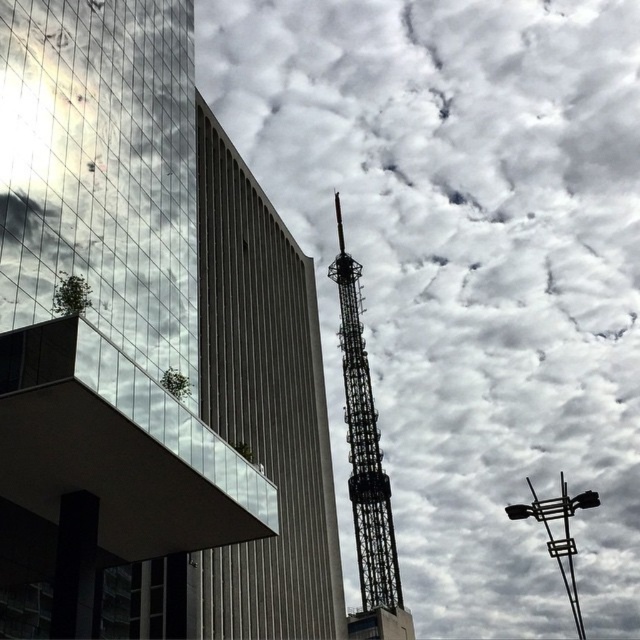
Question: Estimate the real-world distances between objects in this image. Which object is closer to the metallic lattice tower at center?

Choices:
 (A) metallic lattice tower at upper center
 (B) cloudy sky at upper center

Answer: (B)

Question: Among these objects, which one is farthest from the camera?

Choices:
 (A) cloudy sky at upper center
 (B) metallic lattice tower at upper center
 (C) metallic lattice tower at center

Answer: (A)

Question: Can you confirm if cloudy sky at upper center is smaller than metallic lattice tower at center?

Choices:
 (A) yes
 (B) no

Answer: (B)

Question: Can you confirm if metallic lattice tower at upper center is positioned above metallic lattice tower at center?

Choices:
 (A) yes
 (B) no

Answer: (A)

Question: Is the position of cloudy sky at upper center less distant than that of metallic lattice tower at center?

Choices:
 (A) yes
 (B) no

Answer: (B)

Question: Among these points, which one is nearest to the camera?

Choices:
 (A) (32, 369)
 (B) (406, 620)
 (C) (506, 445)

Answer: (A)